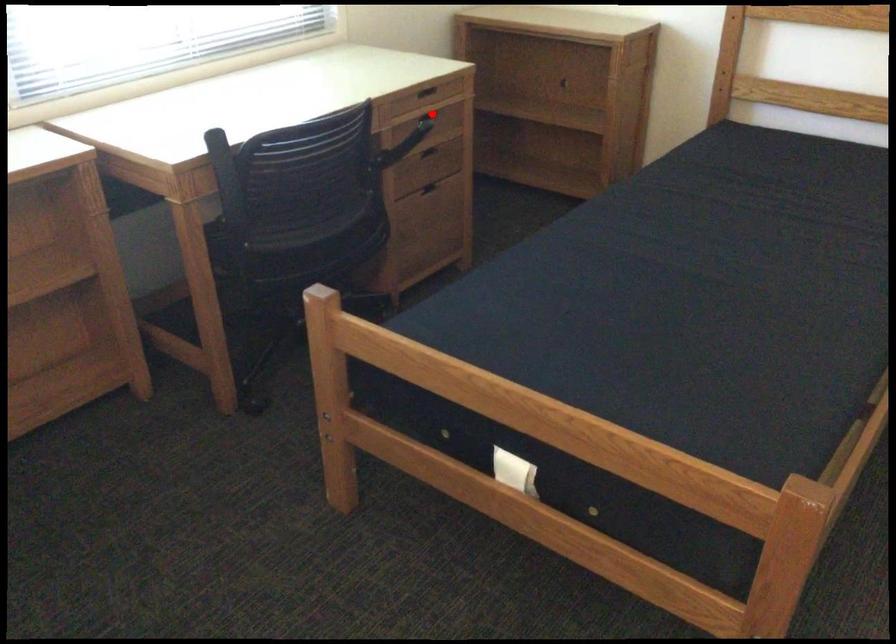
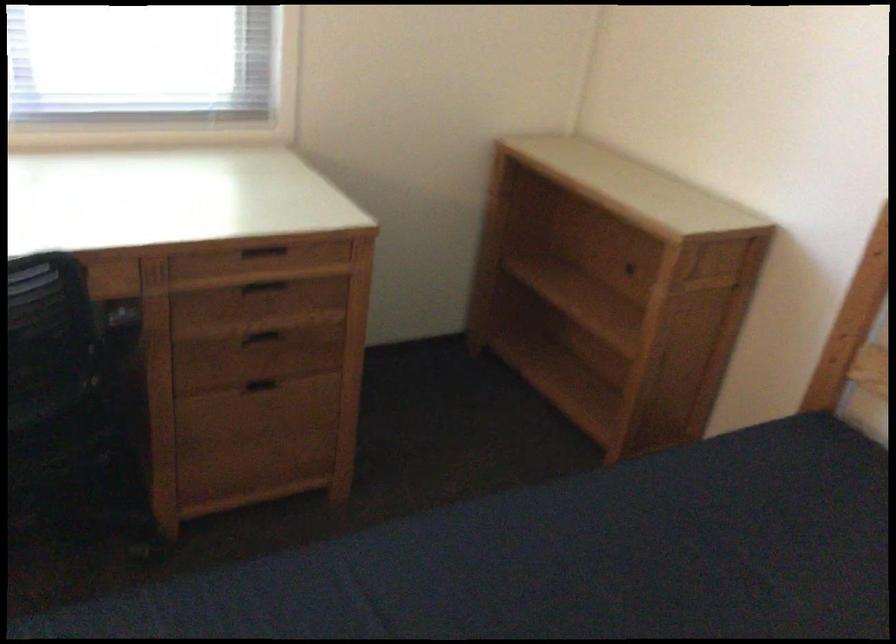
Question: I am providing you with two images of the same scene from different viewpoints. Given a red point in image1, look at the same physical point in image2. Is it:

Choices:
 (A) Closer to the viewpoint
 (B) Farther from the viewpoint

Answer: (A)